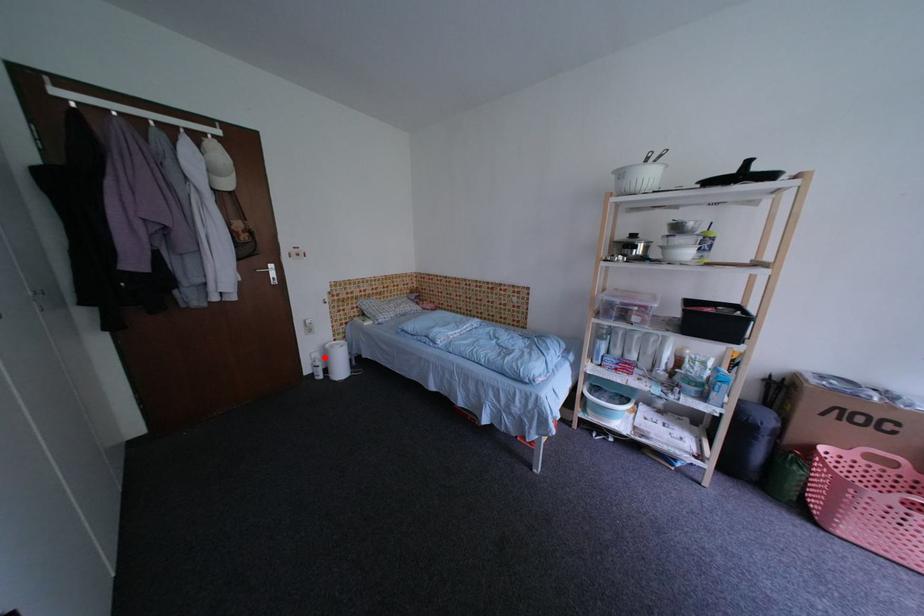
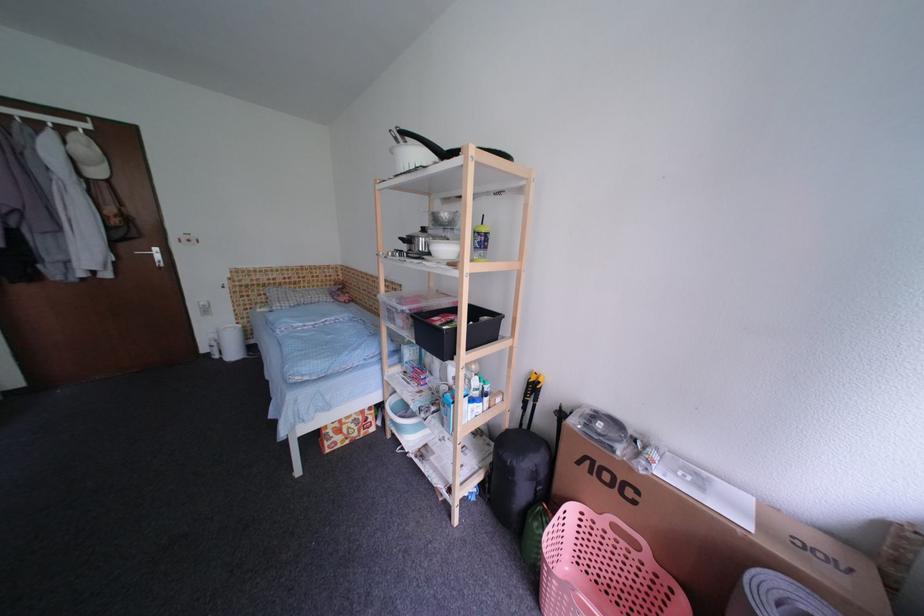
Where in the second image is the point corresponding to the highlighted location from the first image?

(222, 338)